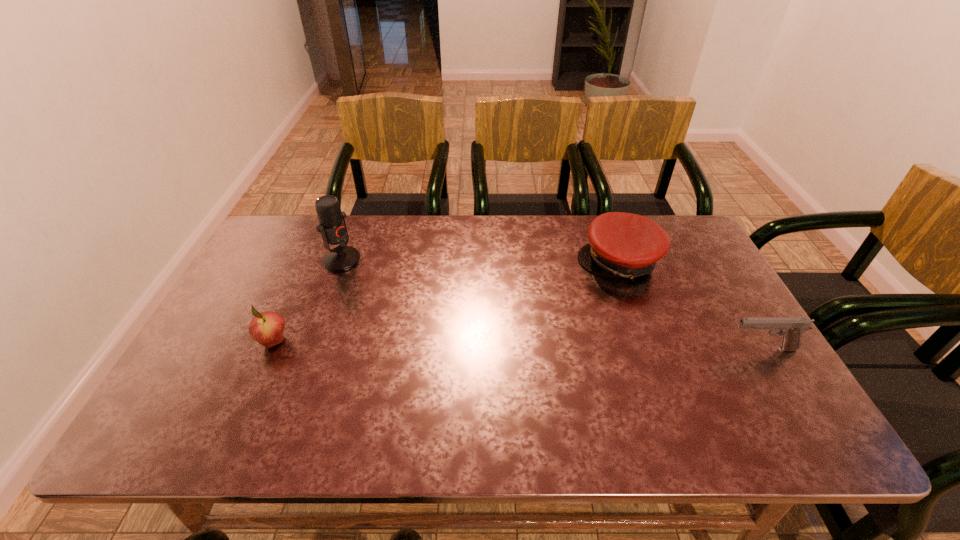
Image resolution: width=960 pixels, height=540 pixels. In order to click on vacant space that is in between the cap and the rightmost object in this screenshot , I will do `click(690, 305)`.

Where is `free space between the leftmost object and the third object from right to left`? Image resolution: width=960 pixels, height=540 pixels. free space between the leftmost object and the third object from right to left is located at coordinates (308, 301).

This screenshot has height=540, width=960. What are the coordinates of `free spot between the tallest object and the pistol` in the screenshot? It's located at (552, 305).

Where is `free spot between the second object from right to left and the tallest object`? The height and width of the screenshot is (540, 960). free spot between the second object from right to left and the tallest object is located at coordinates (481, 261).

Identify the location of free space between the leftmost object and the rightmost object. The height and width of the screenshot is (540, 960). (518, 345).

Where is `free spot between the cap and the apple`? This screenshot has width=960, height=540. free spot between the cap and the apple is located at coordinates (446, 301).

Locate an element on the screen. Image resolution: width=960 pixels, height=540 pixels. object that stands as the closest to the leftmost object is located at coordinates [332, 226].

Choose which object is the nearest neighbor to the tallest object. Please provide its 2D coordinates. Your answer should be formatted as a tuple, i.e. [(x, y)], where the tuple contains the x and y coordinates of a point satisfying the conditions above.

[(267, 328)]

You are a GUI agent. You are given a task and a screenshot of the screen. Output one action in this format:
    pyautogui.click(x=<x>, y=<y>)
    Task: Click on the free spot that satisfies the following two spatial constraints: 1. on the back side of the third object from right to left; 2. on the left side of the leftmost object
    Image resolution: width=960 pixels, height=540 pixels.
    Given the screenshot: What is the action you would take?
    pyautogui.click(x=310, y=260)

Locate an element on the screen. The image size is (960, 540). free spot that satisfies the following two spatial constraints: 1. on the back side of the microphone; 2. on the right side of the leftmost object is located at coordinates (310, 260).